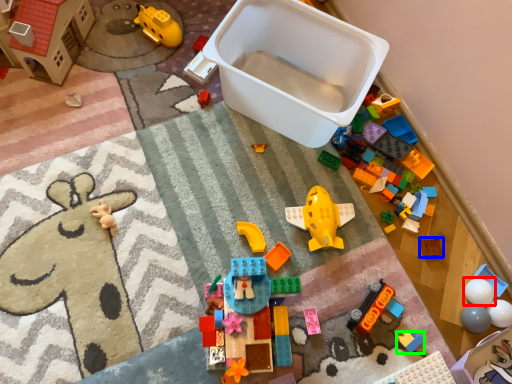
Question: Estimate the real-world distances between objects in this image. Which object is farther from toy (highlighted by a red box), toy (highlighted by a blue box) or toy (highlighted by a green box)?

Choices:
 (A) toy
 (B) toy

Answer: (B)